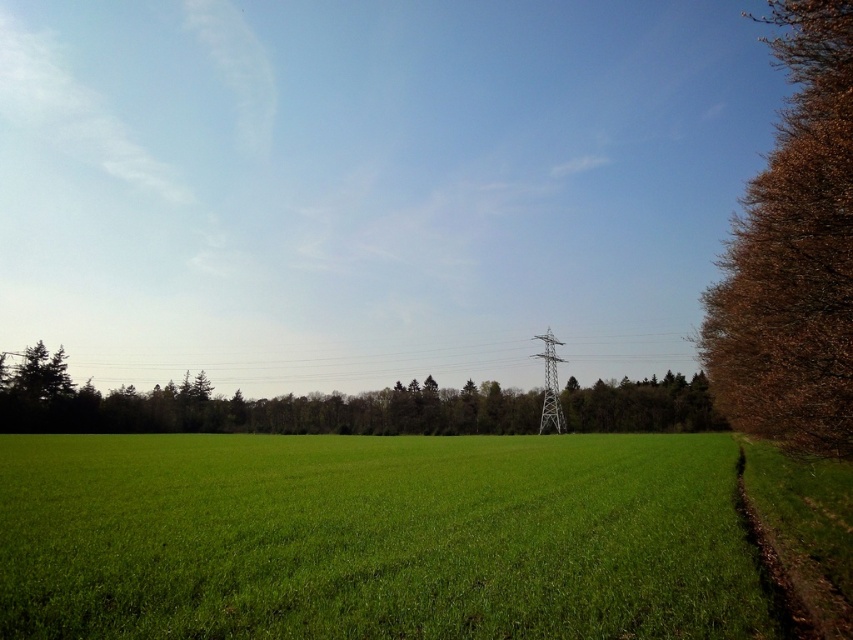
You are standing in the middle of the green grassy field at lower center and want to walk towards the brown textured tree at right. Which direction should you head?

Since the green grassy field at lower center is to the left of the brown textured tree at right, you should head to the right to reach the brown textured tree at right.

You are a bird looking for a perch. You see the brown textured tree at right and the metallic silver power line at center. Which one is thinner and better suited for landing?

The brown textured tree at right is thinner than the metallic silver power line at center, so it is better suited for landing.

You are standing in the rural landscape and want to take a photo of the metallic silver power line at center. To ensure it is in focus, you need to know if it is closer or farther than the green grassy field at lower center. Which one is farther from you?

The metallic silver power line at center is farther from you than the green grassy field at lower center because the green grassy field at lower center is closer to the viewer.